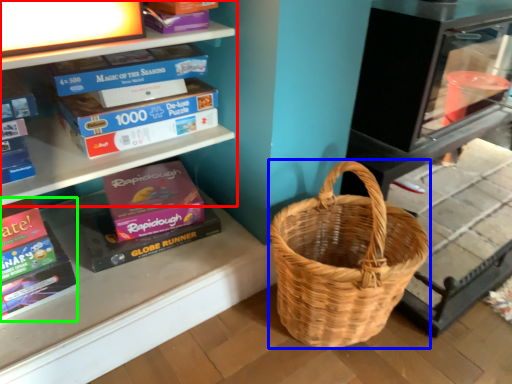
Question: Considering the real-world distances, which object is farthest from shelf (highlighted by a red box)? picnic basket (highlighted by a blue box) or paperback book (highlighted by a green box)?

Choices:
 (A) picnic basket
 (B) paperback book

Answer: (A)